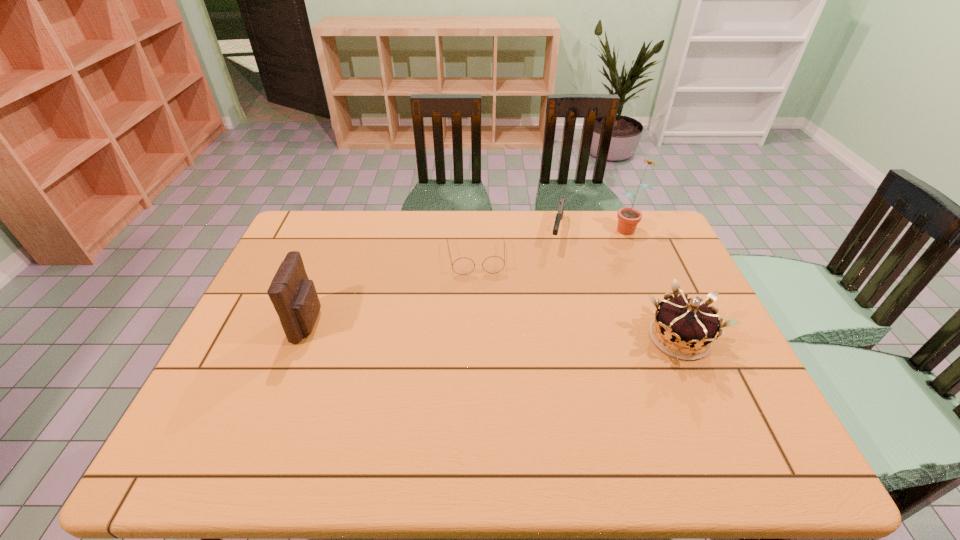
The image size is (960, 540). In order to click on the leftmost object in this screenshot , I will do `click(294, 297)`.

Where is `pouch`? pouch is located at coordinates (294, 297).

At what (x,y) coordinates should I click in order to perform the action: click on crown. Please return your answer as a coordinate pair (x, y). The width and height of the screenshot is (960, 540). Looking at the image, I should click on (684, 328).

The height and width of the screenshot is (540, 960). In order to click on the shortest object in this screenshot , I will do (493, 264).

Where is `the second object from left to right`? This screenshot has height=540, width=960. the second object from left to right is located at coordinates (493, 264).

This screenshot has width=960, height=540. Find the location of `the fourth tallest object`. the fourth tallest object is located at coordinates (559, 216).

Where is `the third object from left to right`? The width and height of the screenshot is (960, 540). the third object from left to right is located at coordinates (559, 216).

Image resolution: width=960 pixels, height=540 pixels. In order to click on sunflower in this screenshot , I will do `click(628, 218)`.

This screenshot has height=540, width=960. I want to click on free location located with an open flap on the leftmost object, so click(441, 323).

The image size is (960, 540). Find the location of `free spot located 0.050m on the left of the third shortest object`. free spot located 0.050m on the left of the third shortest object is located at coordinates (623, 338).